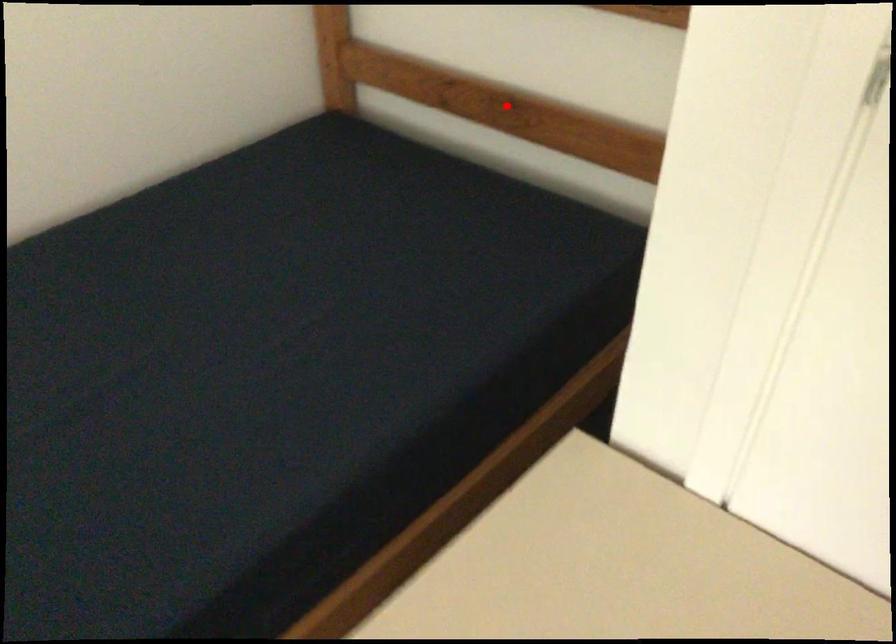
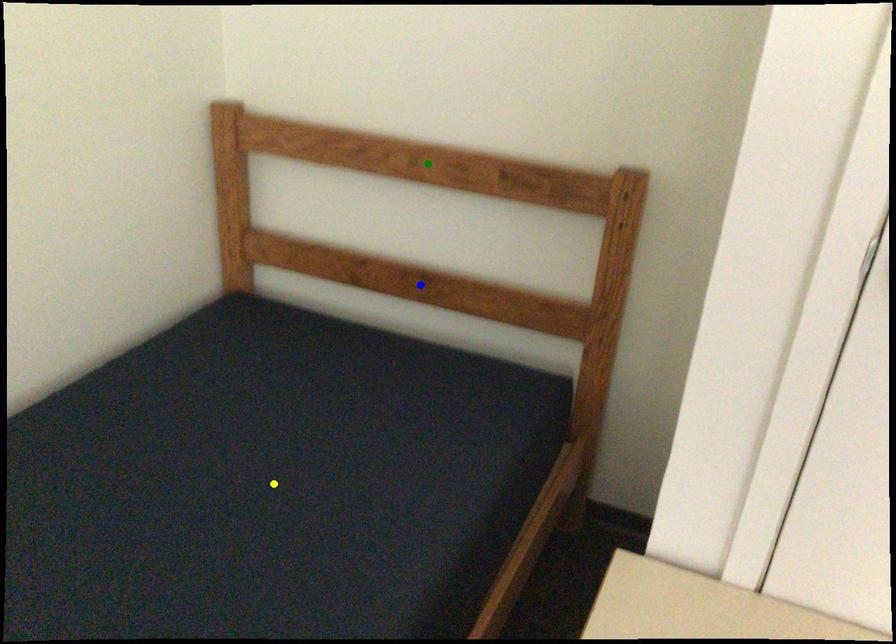
Question: I am providing you with two images of the same scene from different viewpoints. A red point is marked on the first image. You are given multiple points on the second image. Can you choose the point in image 2 that corresponds to the point in image 1?

Choices:
 (A) blue point
 (B) yellow point
 (C) green point

Answer: (A)